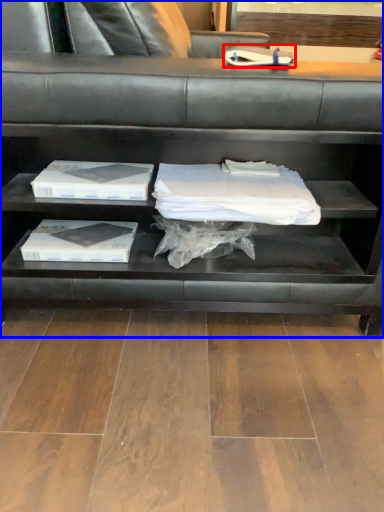
Question: Among these objects, which one is nearest to the camera, book (highlighted by a red box) or shelf (highlighted by a blue box)?

Choices:
 (A) book
 (B) shelf

Answer: (B)